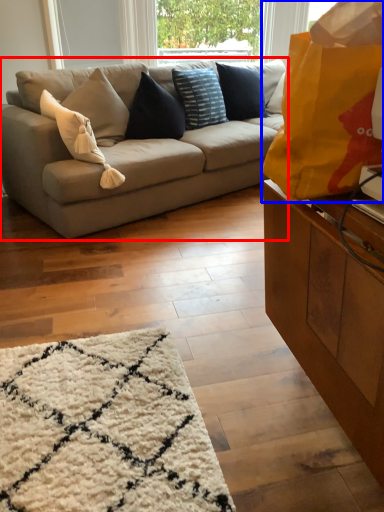
Question: Which object is further to the camera taking this photo, studio couch (highlighted by a red box) or bag (highlighted by a blue box)?

Choices:
 (A) studio couch
 (B) bag

Answer: (A)